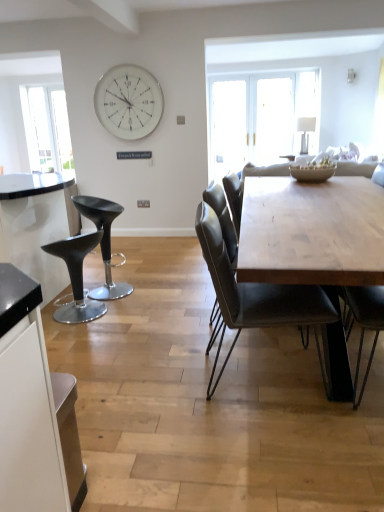
Question: Is the depth of black leather stool at left, the 2th stool when ordered from back to front, greater than that of porcelain textured bowl at center?

Choices:
 (A) no
 (B) yes

Answer: (A)

Question: Is porcelain textured bowl at center completely or partially inside black leather stool at left, positioned as the 1th stool in front-to-back order?

Choices:
 (A) no
 (B) yes

Answer: (A)

Question: Is black leather stool at left, the 2th stool when ordered from back to front, wider than porcelain textured bowl at center?

Choices:
 (A) yes
 (B) no

Answer: (A)

Question: Considering the relative sizes of black leather stool at left, positioned as the 1th stool in front-to-back order, and porcelain textured bowl at center in the image provided, is black leather stool at left, positioned as the 1th stool in front-to-back order, thinner than porcelain textured bowl at center?

Choices:
 (A) yes
 (B) no

Answer: (B)

Question: Is black leather stool at left, the 2th stool when ordered from back to front, to the left of porcelain textured bowl at center from the viewer's perspective?

Choices:
 (A) yes
 (B) no

Answer: (A)

Question: Does black leather stool at left, the 2th stool when ordered from back to front, have a smaller size compared to porcelain textured bowl at center?

Choices:
 (A) yes
 (B) no

Answer: (B)

Question: Can you confirm if matte black stool at left, which is counted as the 2th stool, starting from the front, is taller than white metallic clock at upper center?

Choices:
 (A) no
 (B) yes

Answer: (A)

Question: Is white metallic clock at upper center surrounded by matte black stool at left, arranged as the first stool when viewed from the back?

Choices:
 (A) no
 (B) yes

Answer: (A)

Question: Is matte black stool at left, arranged as the first stool when viewed from the back, smaller than white metallic clock at upper center?

Choices:
 (A) yes
 (B) no

Answer: (B)

Question: Is matte black stool at left, arranged as the first stool when viewed from the back, at the right side of white metallic clock at upper center?

Choices:
 (A) yes
 (B) no

Answer: (A)

Question: Is the depth of matte black stool at left, which is counted as the 2th stool, starting from the front, less than that of white metallic clock at upper center?

Choices:
 (A) no
 (B) yes

Answer: (B)

Question: Is matte black stool at left, arranged as the first stool when viewed from the back, outside white metallic clock at upper center?

Choices:
 (A) no
 (B) yes

Answer: (B)

Question: Does porcelain textured bowl at center lie in front of black leather stool at left, positioned as the 1th stool in front-to-back order?

Choices:
 (A) no
 (B) yes

Answer: (A)